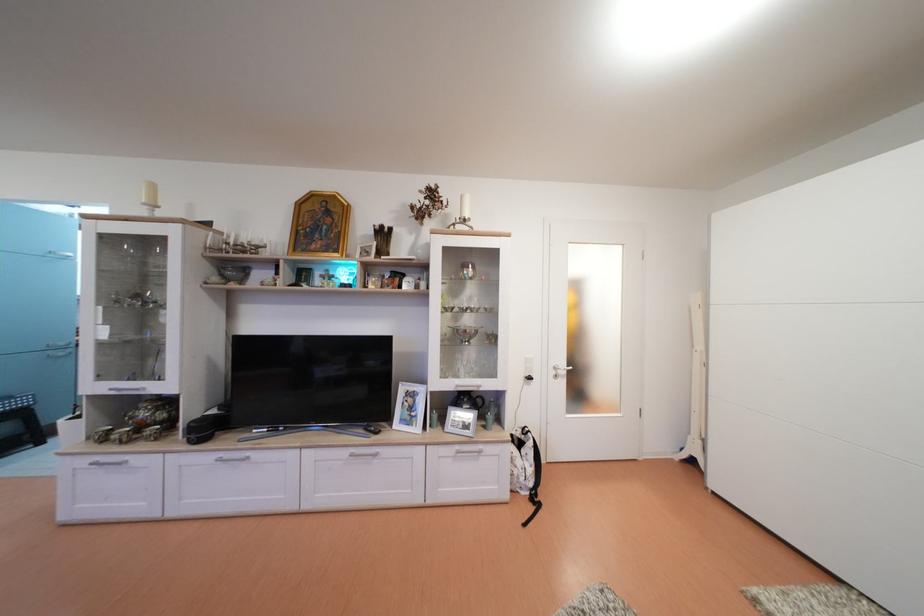
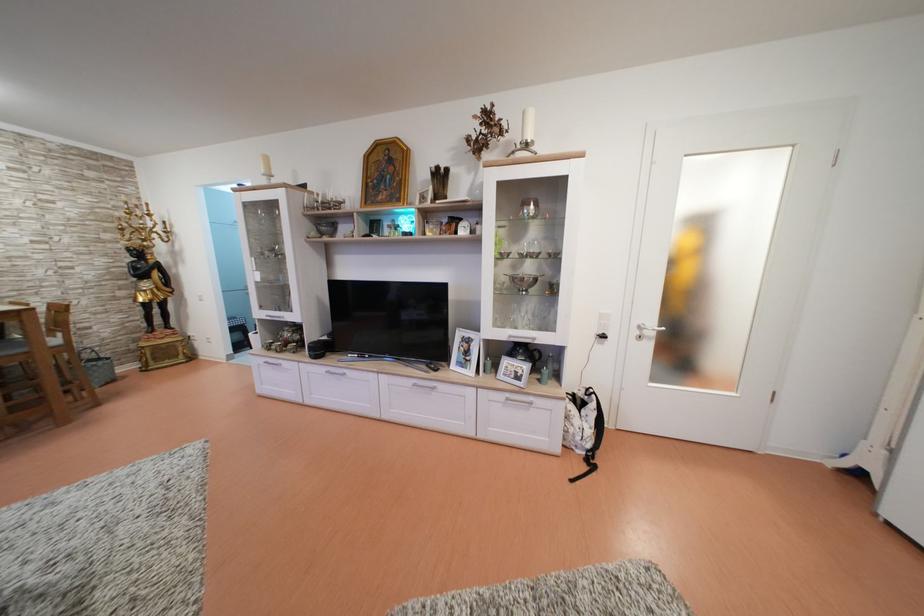
In the second image, find the point that corresponds to (468,201) in the first image.

(530, 119)